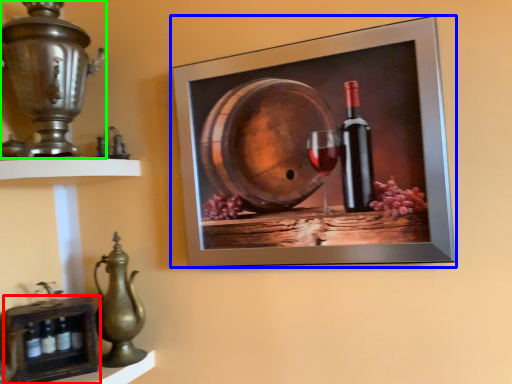
Question: Considering the real-world distances, which object is farthest from shelf (highlighted by a red box)? picture frame (highlighted by a blue box) or candle holder (highlighted by a green box)?

Choices:
 (A) picture frame
 (B) candle holder

Answer: (A)